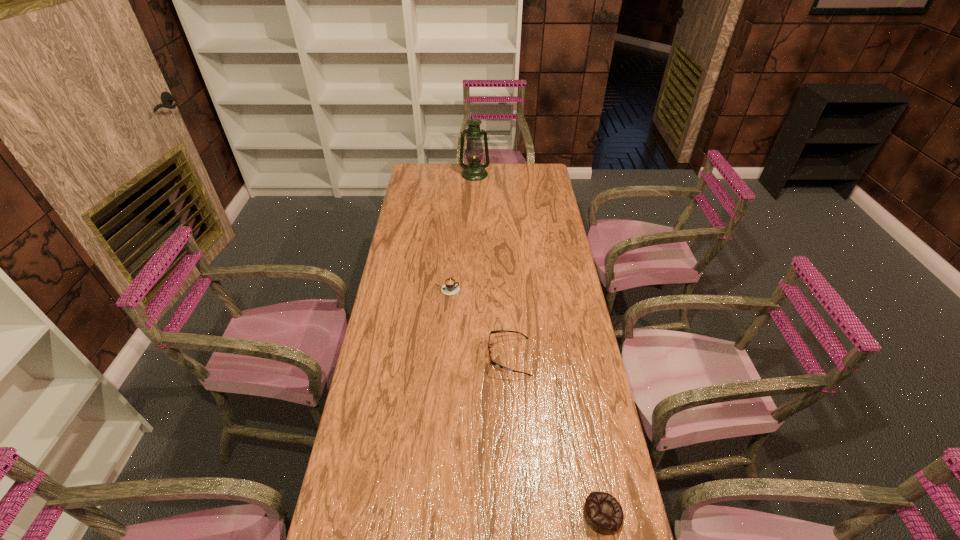
Where is `the tallest object`? the tallest object is located at coordinates (473, 171).

Locate an element on the screen. oil lamp is located at coordinates (473, 171).

The width and height of the screenshot is (960, 540). What are the coordinates of `the third shortest object` in the screenshot? It's located at (499, 331).

Image resolution: width=960 pixels, height=540 pixels. I want to click on sunglasses, so click(499, 331).

Find the location of `the nearest object`. the nearest object is located at coordinates (603, 513).

Locate an element on the screen. Image resolution: width=960 pixels, height=540 pixels. the rightmost object is located at coordinates (603, 513).

Locate an element on the screen. The image size is (960, 540). cappuccino is located at coordinates click(x=450, y=287).

Where is `vacant space situated on the right of the oil lamp`? The height and width of the screenshot is (540, 960). vacant space situated on the right of the oil lamp is located at coordinates (546, 174).

The width and height of the screenshot is (960, 540). Identify the location of vacant space situated 0.070m on the front-facing side of the sunglasses. click(467, 357).

Where is `free region located on the front-facing side of the sunglasses`? This screenshot has width=960, height=540. free region located on the front-facing side of the sunglasses is located at coordinates (400, 357).